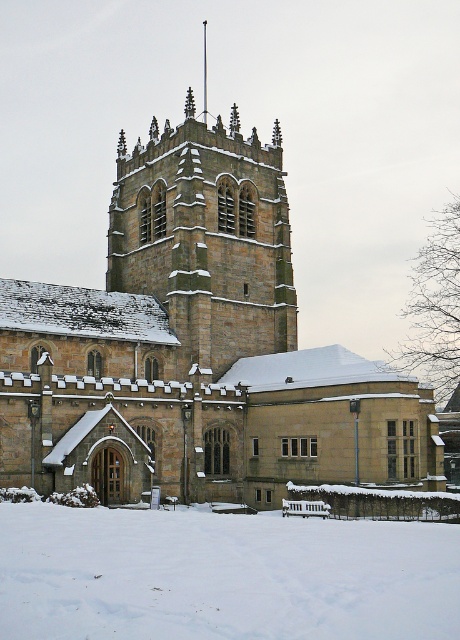
Question: Is white powdery snow at lower center smaller than brown stone tower at center?

Choices:
 (A) no
 (B) yes

Answer: (B)

Question: Among these points, which one is farthest from the camera?

Choices:
 (A) (391, 582)
 (B) (259, 344)

Answer: (B)

Question: Does white powdery snow at lower center have a greater width compared to brown stone tower at center?

Choices:
 (A) yes
 (B) no

Answer: (A)

Question: Is white powdery snow at lower center positioned in front of brown stone tower at center?

Choices:
 (A) no
 (B) yes

Answer: (B)

Question: Which point is closer to the camera?

Choices:
 (A) white powdery snow at lower center
 (B) brown stone tower at center

Answer: (A)